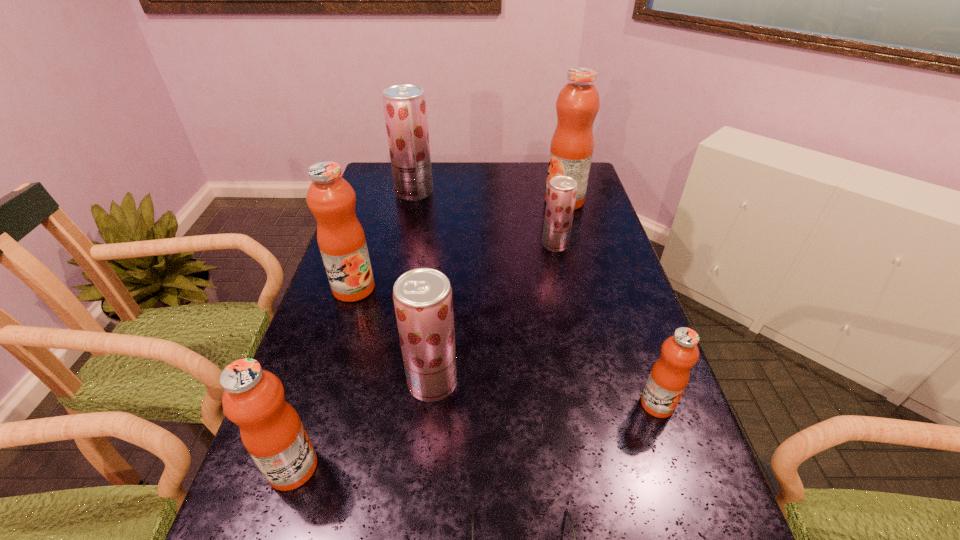
This screenshot has width=960, height=540. I want to click on vacant space situated 0.160m on the left of the second nearest strawberry fruit juice, so tap(492, 245).

You are a GUI agent. You are given a task and a screenshot of the screen. Output one action in this format:
    pyautogui.click(x=<x>, y=<y>)
    Task: Click on the vacant position located 0.060m on the front label of the smallest orange fruit juice
    The width and height of the screenshot is (960, 540).
    Given the screenshot: What is the action you would take?
    pyautogui.click(x=671, y=446)

Identify the location of object positioned at the far left corner. This screenshot has height=540, width=960. (405, 110).

The image size is (960, 540). I want to click on object at the far right corner, so click(571, 149).

I want to click on free region at the far edge of the desktop, so click(x=511, y=188).

You are a GUI agent. You are given a task and a screenshot of the screen. Output one action in this format:
    pyautogui.click(x=<x>, y=<y>)
    Task: Click on the free space at the left edge of the desktop
    Image resolution: width=960 pixels, height=540 pixels.
    Given the screenshot: What is the action you would take?
    pyautogui.click(x=364, y=205)

The width and height of the screenshot is (960, 540). Find the location of `free spot at the right edge of the desktop`. free spot at the right edge of the desktop is located at coordinates 606,225.

Find the location of a particular element. vacant region between the rightmost strawberry fruit juice and the second strawberry fruit juice from left to right is located at coordinates (493, 314).

This screenshot has width=960, height=540. Find the location of `vacant space that is in between the fourth fruit juice from left to right and the third farthest orange fruit juice`. vacant space that is in between the fourth fruit juice from left to right and the third farthest orange fruit juice is located at coordinates 545,393.

I want to click on vacant area that lies between the third farthest orange fruit juice and the biggest orange fruit juice, so click(x=611, y=303).